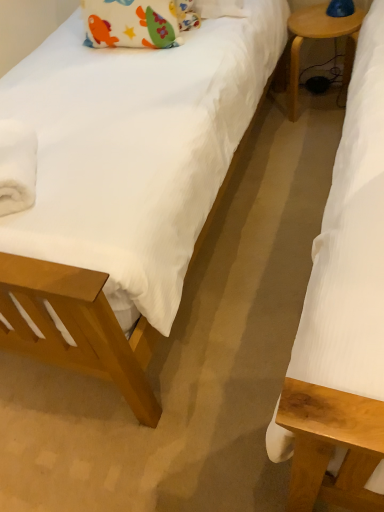
Question: From a real-world perspective, is soft cotton pillow at upper left positioned above or below wooden side table at right?

Choices:
 (A) below
 (B) above

Answer: (B)

Question: From the image's perspective, relative to wooden side table at right, is soft cotton pillow at upper left above or below?

Choices:
 (A) above
 (B) below

Answer: (B)

Question: Based on their relative distances, which object is farther from the soft cotton pillow at upper left?

Choices:
 (A) white fluffy towel at left
 (B) wooden side table at right

Answer: (A)

Question: Which object is positioned farthest from the wooden side table at right?

Choices:
 (A) soft cotton pillow at upper left
 (B) white fluffy towel at left

Answer: (B)